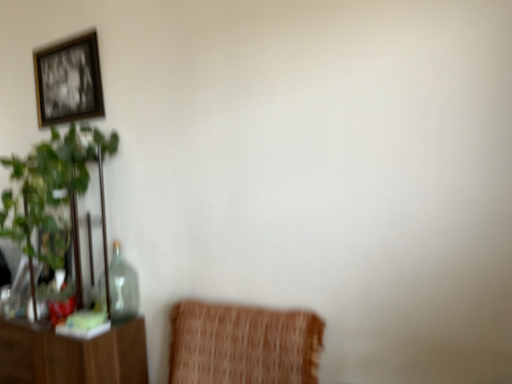
Question: Considering the relative sizes of green leafy plant at left and gold-framed picture at upper left in the image provided, is green leafy plant at left thinner than gold-framed picture at upper left?

Choices:
 (A) yes
 (B) no

Answer: (B)

Question: From the image's perspective, is green leafy plant at left on gold-framed picture at upper left?

Choices:
 (A) no
 (B) yes

Answer: (A)

Question: Is green leafy plant at left not near gold-framed picture at upper left?

Choices:
 (A) no
 (B) yes

Answer: (A)

Question: Is green leafy plant at left not within gold-framed picture at upper left?

Choices:
 (A) yes
 (B) no

Answer: (A)

Question: Is green leafy plant at left bigger than gold-framed picture at upper left?

Choices:
 (A) no
 (B) yes

Answer: (B)

Question: Is green leafy plant at left oriented away from gold-framed picture at upper left?

Choices:
 (A) yes
 (B) no

Answer: (B)

Question: Does transparent glass bottle at left come behind gold-framed picture at upper left?

Choices:
 (A) yes
 (B) no

Answer: (B)

Question: From the image's perspective, is transparent glass bottle at left above gold-framed picture at upper left?

Choices:
 (A) no
 (B) yes

Answer: (A)

Question: From a real-world perspective, is transparent glass bottle at left physically above gold-framed picture at upper left?

Choices:
 (A) yes
 (B) no

Answer: (B)

Question: Can you see transparent glass bottle at left touching gold-framed picture at upper left?

Choices:
 (A) yes
 (B) no

Answer: (B)

Question: Does transparent glass bottle at left have a greater height compared to gold-framed picture at upper left?

Choices:
 (A) no
 (B) yes

Answer: (A)

Question: Is transparent glass bottle at left looking in the opposite direction of gold-framed picture at upper left?

Choices:
 (A) yes
 (B) no

Answer: (B)

Question: Considering the relative sizes of gold-framed picture at upper left and green leafy plant at left in the image provided, is gold-framed picture at upper left wider than green leafy plant at left?

Choices:
 (A) no
 (B) yes

Answer: (A)